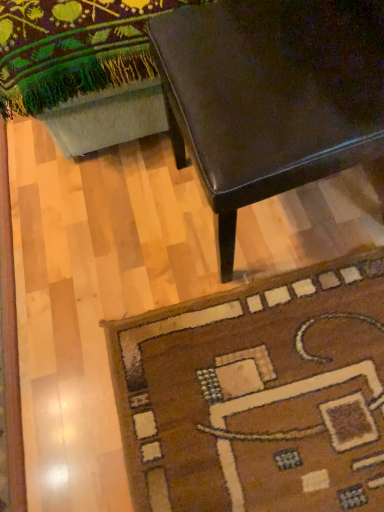
What do you see at coordinates (270, 96) in the screenshot? The height and width of the screenshot is (512, 384). I see `shiny dark brown table at upper right` at bounding box center [270, 96].

Find the location of `shiny dark brown table at upper right`. shiny dark brown table at upper right is located at coordinates (270, 96).

Measure the distance between point (208,89) and camera.

Point (208,89) and camera are 75.00 centimeters apart.

Describe the element at coordinates (258, 395) in the screenshot. I see `brown woolen rug at lower right` at that location.

The height and width of the screenshot is (512, 384). I want to click on brown woolen rug at lower right, so click(258, 395).

Identify the location of shiny dark brown table at upper right. (270, 96).

Consider the image. Considering the relative positions of shiny dark brown table at upper right and brown woolen rug at lower right in the image provided, is shiny dark brown table at upper right to the left or to the right of brown woolen rug at lower right?

In the image, shiny dark brown table at upper right appears on the right side of brown woolen rug at lower right.

Which object is further away from the camera taking this photo, shiny dark brown table at upper right or brown woolen rug at lower right?

brown woolen rug at lower right is more distant.

Is point (363, 4) farther from viewer compared to point (282, 307)?

No, (363, 4) is closer to viewer.

From the image's perspective, which is above, shiny dark brown table at upper right or brown woolen rug at lower right?

shiny dark brown table at upper right, from the image's perspective.

From a real-world perspective, is shiny dark brown table at upper right positioned above or below brown woolen rug at lower right?

Clearly, from a real-world perspective, shiny dark brown table at upper right is above brown woolen rug at lower right.

Does shiny dark brown table at upper right have a lesser width compared to brown woolen rug at lower right?

Yes.

Can you confirm if shiny dark brown table at upper right is taller than brown woolen rug at lower right?

Correct, shiny dark brown table at upper right is much taller as brown woolen rug at lower right.

Between shiny dark brown table at upper right and brown woolen rug at lower right, which one has larger size?

shiny dark brown table at upper right is bigger.

Which is correct: shiny dark brown table at upper right is inside brown woolen rug at lower right, or outside of it?

shiny dark brown table at upper right exists outside the volume of brown woolen rug at lower right.

Is shiny dark brown table at upper right with brown woolen rug at lower right?

No, shiny dark brown table at upper right is not next to brown woolen rug at lower right.

Is shiny dark brown table at upper right aimed at brown woolen rug at lower right?

No, shiny dark brown table at upper right is not turned towards brown woolen rug at lower right.

How different are the orientations of shiny dark brown table at upper right and brown woolen rug at lower right in degrees?

There is a 2.57-degree angle between the facing directions of shiny dark brown table at upper right and brown woolen rug at lower right.

The height and width of the screenshot is (512, 384). I want to click on mat that is behind the shiny dark brown table at upper right, so click(x=258, y=395).

Which is more to the left, brown woolen rug at lower right or shiny dark brown table at upper right?

brown woolen rug at lower right is more to the left.

Is the depth of brown woolen rug at lower right greater than that of shiny dark brown table at upper right?

Yes, brown woolen rug at lower right is further from the viewer.

Does point (283, 396) come closer to viewer compared to point (365, 129)?

No.

From the image's perspective, is brown woolen rug at lower right located above or below shiny dark brown table at upper right?

brown woolen rug at lower right is situated lower than shiny dark brown table at upper right in the image.

From a real-world perspective, between brown woolen rug at lower right and shiny dark brown table at upper right, who is vertically lower?

In real-world perspective, brown woolen rug at lower right is lower.

Can you confirm if brown woolen rug at lower right is thinner than shiny dark brown table at upper right?

In fact, brown woolen rug at lower right might be wider than shiny dark brown table at upper right.

Can you confirm if brown woolen rug at lower right is shorter than shiny dark brown table at upper right?

Correct, brown woolen rug at lower right is not as tall as shiny dark brown table at upper right.

Is brown woolen rug at lower right bigger than shiny dark brown table at upper right?

Actually, brown woolen rug at lower right might be smaller than shiny dark brown table at upper right.

Is brown woolen rug at lower right located outside shiny dark brown table at upper right?

Yes, brown woolen rug at lower right is not within shiny dark brown table at upper right.

Is brown woolen rug at lower right placed right next to shiny dark brown table at upper right?

No.

Is brown woolen rug at lower right oriented away from shiny dark brown table at upper right?

No, brown woolen rug at lower right's orientation is not away from shiny dark brown table at upper right.

How many degrees apart are the facing directions of brown woolen rug at lower right and shiny dark brown table at upper right?

The angle between the facing direction of brown woolen rug at lower right and the facing direction of shiny dark brown table at upper right is 2.57 degrees.

Where is `mat that appears below the shiny dark brown table at upper right (from the image's perspective)`? mat that appears below the shiny dark brown table at upper right (from the image's perspective) is located at coordinates (258, 395).

I want to click on mat located behind the shiny dark brown table at upper right, so click(x=258, y=395).

This screenshot has width=384, height=512. Identify the location of mat on the left of shiny dark brown table at upper right. (258, 395).